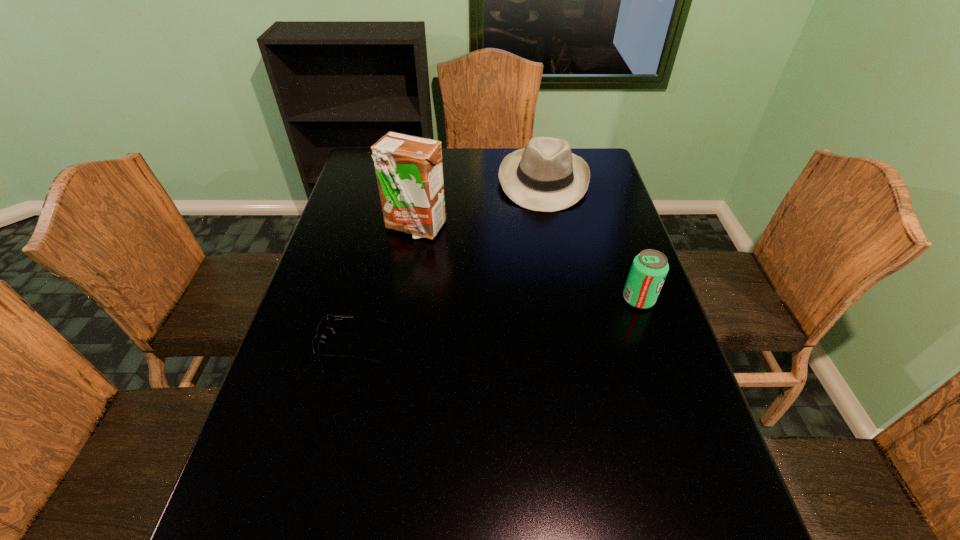
The height and width of the screenshot is (540, 960). I want to click on the shortest object, so click(x=328, y=320).

You are a GUI agent. You are given a task and a screenshot of the screen. Output one action in this format:
    pyautogui.click(x=<x>, y=<y>)
    Task: Click on the nearest object
    
    Given the screenshot: What is the action you would take?
    pyautogui.click(x=328, y=320)

Locate an element on the screen. the third farthest object is located at coordinates (649, 269).

Where is `carton`? The image size is (960, 540). carton is located at coordinates (409, 169).

Find the location of `fedora`. fedora is located at coordinates (546, 176).

This screenshot has width=960, height=540. In order to click on free spot located 0.310m on the straw side of the tallest object in this screenshot , I will do `click(457, 316)`.

Where is `free region located 0.380m on the straw side of the tallest object`? The width and height of the screenshot is (960, 540). free region located 0.380m on the straw side of the tallest object is located at coordinates coord(466,338).

Where is `free space located 0.230m on the straw side of the tallest object`? This screenshot has height=540, width=960. free space located 0.230m on the straw side of the tallest object is located at coordinates (447, 295).

I want to click on vacant point located 0.250m on the front-facing side of the fedora, so click(x=544, y=266).

You are a GUI agent. You are given a task and a screenshot of the screen. Output one action in this format:
    pyautogui.click(x=<x>, y=<y>)
    Task: Click on the vacant region located on the front-facing side of the fedora
    
    Given the screenshot: What is the action you would take?
    pyautogui.click(x=544, y=242)